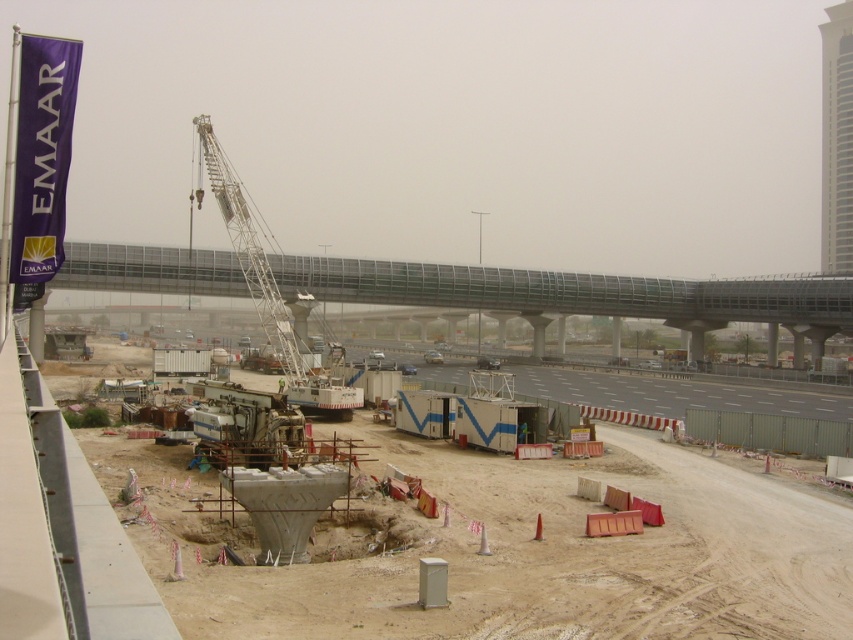
Is point (561, 467) less distant than point (657, 298)?

Yes.

Does concrete at center appear over metallic gray bridge at center?

No, concrete at center is not above metallic gray bridge at center.

Who is more forward, (190, 545) or (80, 241)?

Point (190, 545) is more forward.

I want to click on concrete at center, so click(509, 548).

Can you confirm if concrete at center is thinner than gray concrete highway at center?

Yes, concrete at center is thinner than gray concrete highway at center.

Where is `concrete at center`? The image size is (853, 640). concrete at center is located at coordinates (509, 548).

Identify the location of concrete at center. (509, 548).

Measure the distance from gray concrete highway at center to white metallic crane at center-left.

17.93 meters

Between gray concrete highway at center and white metallic crane at center-left, which one appears on the left side from the viewer's perspective?

From the viewer's perspective, white metallic crane at center-left appears more on the left side.

Is point (550, 400) positioned before point (206, 134)?

No.

Locate an element on the screen. gray concrete highway at center is located at coordinates (704, 406).